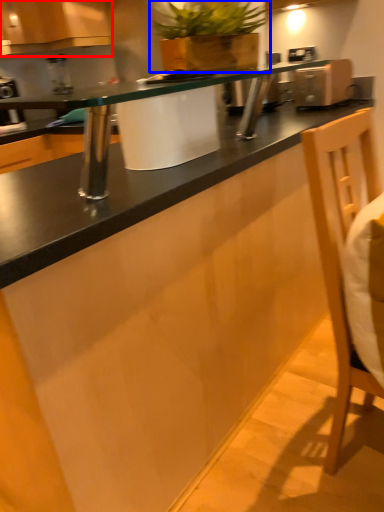
Question: Which object appears farthest to the camera in this image, cabinetry (highlighted by a red box) or houseplant (highlighted by a blue box)?

Choices:
 (A) cabinetry
 (B) houseplant

Answer: (A)